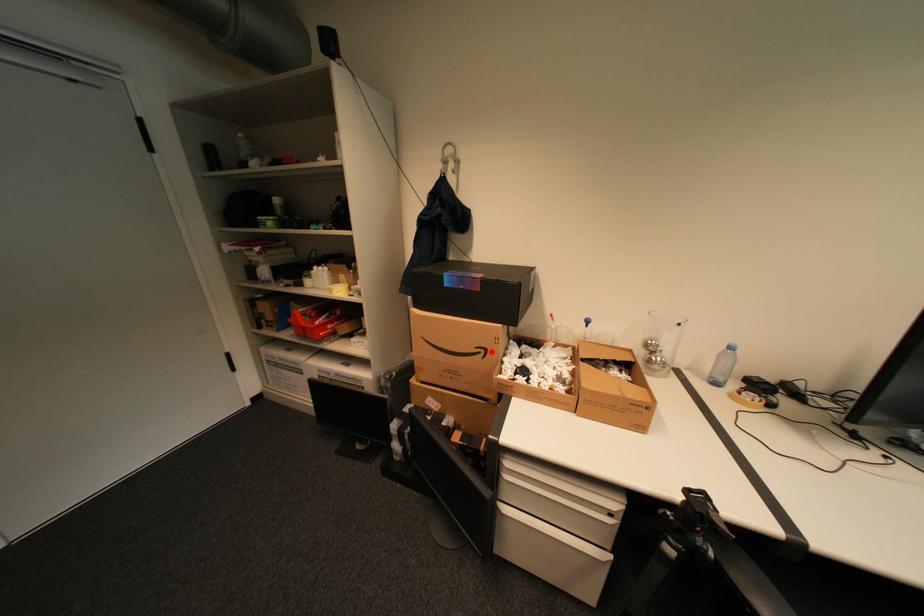
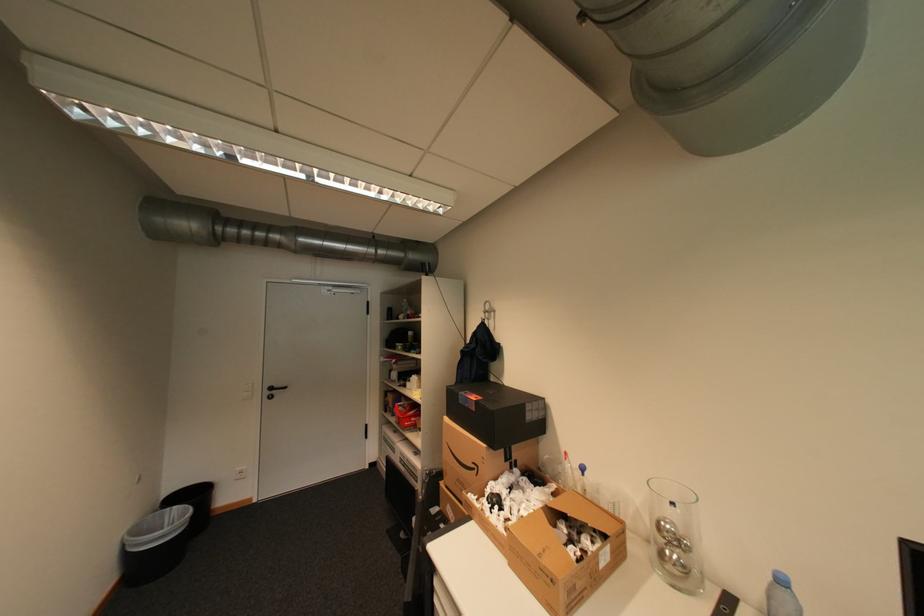
Question: I am providing you with two images of the same scene from different viewpoints. A red point is shown in image1. For the corresponding object point in image2, is it positioned nearer or farther from the camera?

Choices:
 (A) Nearer
 (B) Farther

Answer: (B)